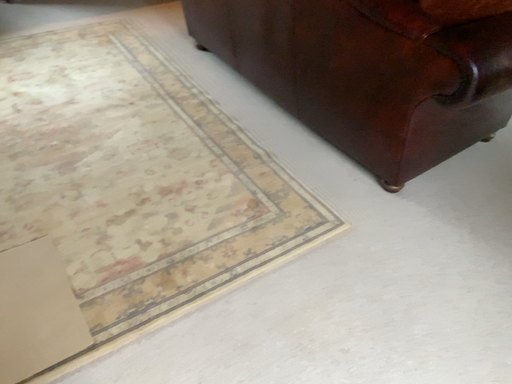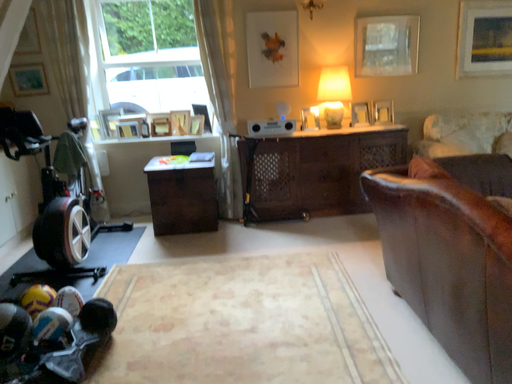
Question: Which way did the camera rotate in the video?

Choices:
 (A) rotated left
 (B) rotated right

Answer: (A)